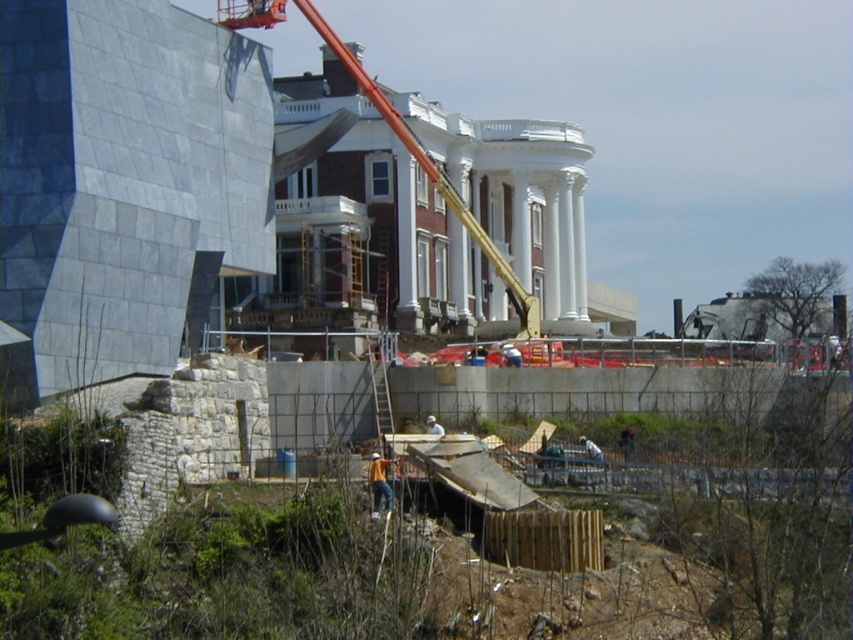
Question: Can you confirm if orange safety vest at center is positioned to the right of white matte hard hat at center?

Choices:
 (A) yes
 (B) no

Answer: (B)

Question: Which point is closer to the camera taking this photo?

Choices:
 (A) (277, 13)
 (B) (440, 433)

Answer: (B)

Question: Which is nearer to the white matte hard hat at center?

Choices:
 (A) orange metallic crane at center
 (B) orange safety vest at center

Answer: (B)

Question: Among these objects, which one is nearest to the camera?

Choices:
 (A) orange metallic crane at center
 (B) orange safety vest at center
 (C) white matte hard hat at center

Answer: (B)

Question: Does orange metallic crane at center appear on the left side of orange safety vest at center?

Choices:
 (A) yes
 (B) no

Answer: (A)

Question: Can you confirm if orange safety vest at center is smaller than white matte hard hat at center?

Choices:
 (A) yes
 (B) no

Answer: (B)